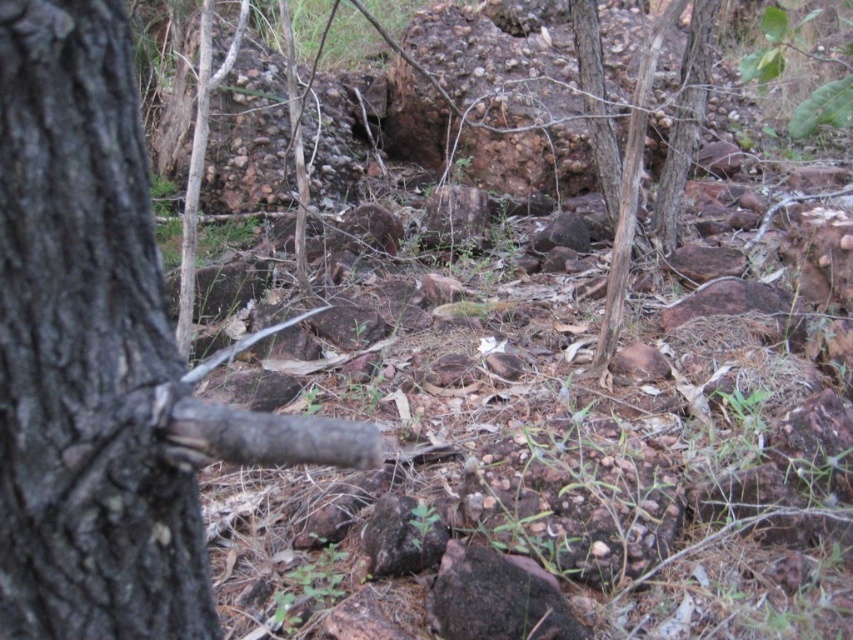
Question: Does dark brown rough rock at center appear on the right side of brown rough tree trunk at center?

Choices:
 (A) no
 (B) yes

Answer: (A)

Question: Can you confirm if dark brown bark tree at left is positioned below brown rough tree trunk at center?

Choices:
 (A) yes
 (B) no

Answer: (A)

Question: Which object is closer to the camera taking this photo?

Choices:
 (A) dark brown rough rock at center
 (B) brown rough tree trunk at center
 (C) dark brown bark tree at left

Answer: (C)

Question: Considering the real-world distances, which object is closest to the dark brown bark tree at left?

Choices:
 (A) brown rough tree trunk at center
 (B) dark brown rough rock at center

Answer: (B)

Question: Can you confirm if dark brown bark tree at left is bigger than dark brown rough rock at center?

Choices:
 (A) no
 (B) yes

Answer: (B)

Question: Which point is closer to the camera taking this photo?

Choices:
 (A) (428, 612)
 (B) (120, 634)
 (C) (622, 227)

Answer: (B)